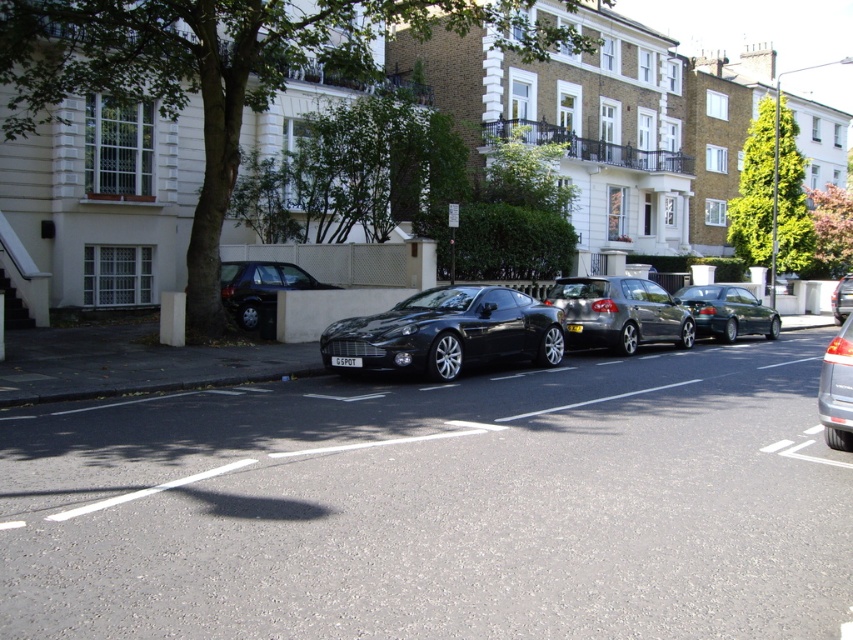
You are a delivery driver who needs to park your vehicle in this street. You see the metallic silver car at right and the black metallic license plate at center. Which one should you avoid parking next to to ensure enough space for your delivery van?

The metallic silver car at right is bigger than the black metallic license plate at center, so you should avoid parking next to the metallic silver car at right to ensure enough space for your delivery van.

You are a delivery driver needing to park your vehicle in this residential area. The shiny black sedan at center is parked at coordinates 0.453, 0.306. Can you estimate whether this parking spot is within the designated parking zone, which is defined as the area between coordinates 0.3 and 0.7 on the x and y axes?

The shiny black sedan at center is parked at coordinates (260, 289). Since both coordinates fall within the range of 0.3 to 0.7, the parking spot is within the designated parking zone.